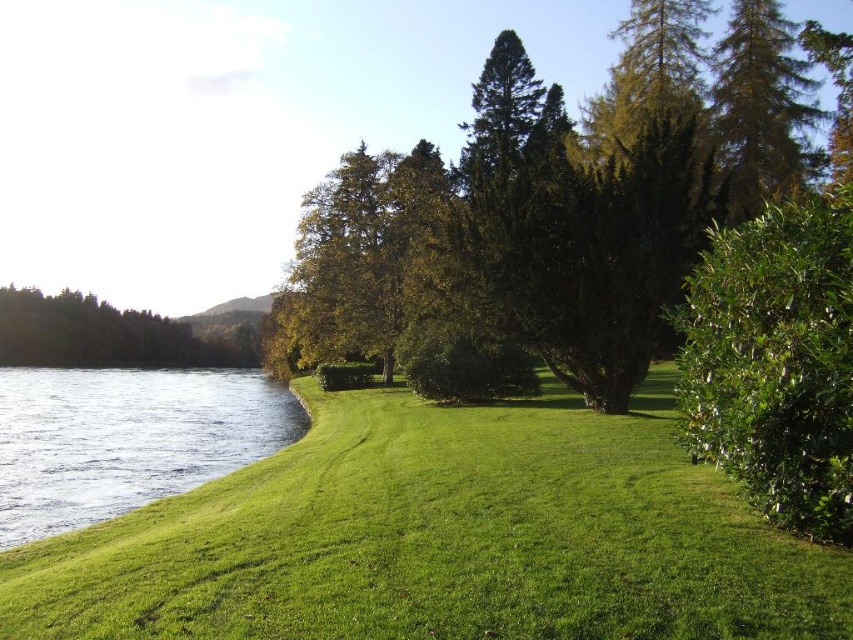
Question: Is green grass at lower left positioned at the back of green leafy tree at left?

Choices:
 (A) no
 (B) yes

Answer: (A)

Question: Does green grass at lower left appear on the left side of green needle-like at upper right?

Choices:
 (A) no
 (B) yes

Answer: (B)

Question: Which point appears closest to the camera in this image?

Choices:
 (A) (158, 621)
 (B) (692, 456)

Answer: (A)

Question: Which point is farther to the camera?

Choices:
 (A) (260, 604)
 (B) (790, 128)
 (C) (21, 397)
 (D) (717, 138)

Answer: (C)

Question: Among these points, which one is farthest from the camera?

Choices:
 (A) (389, 358)
 (B) (763, 164)
 (C) (86, 611)
 (D) (791, 250)

Answer: (A)

Question: Does green leafy bush at right appear on the right side of clear water at lower left?

Choices:
 (A) yes
 (B) no

Answer: (A)